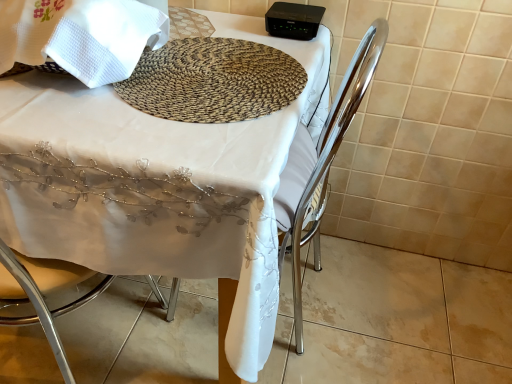
Find the location of a particular element. The width and height of the screenshot is (512, 384). free space above white fabric table at center (from a real-world perspective) is located at coordinates (169, 71).